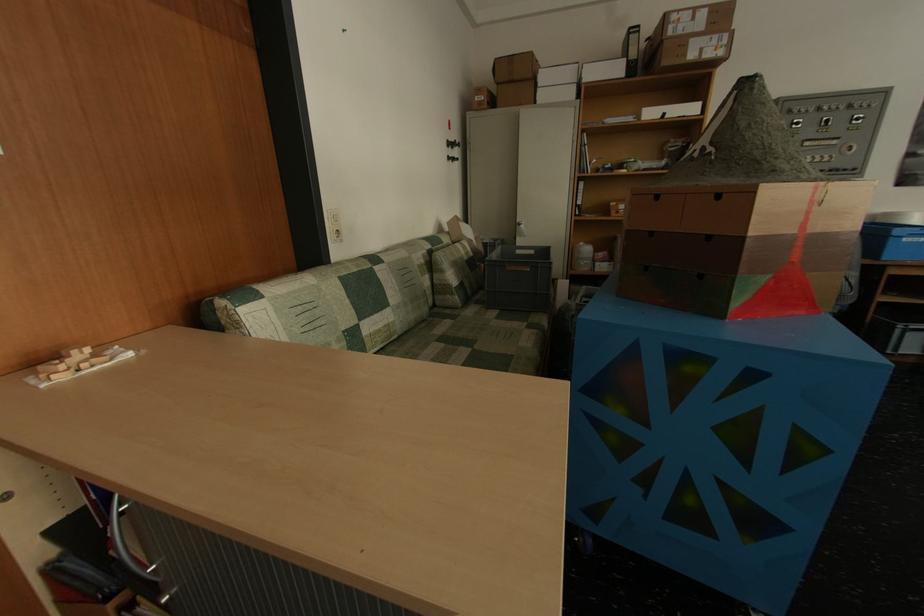
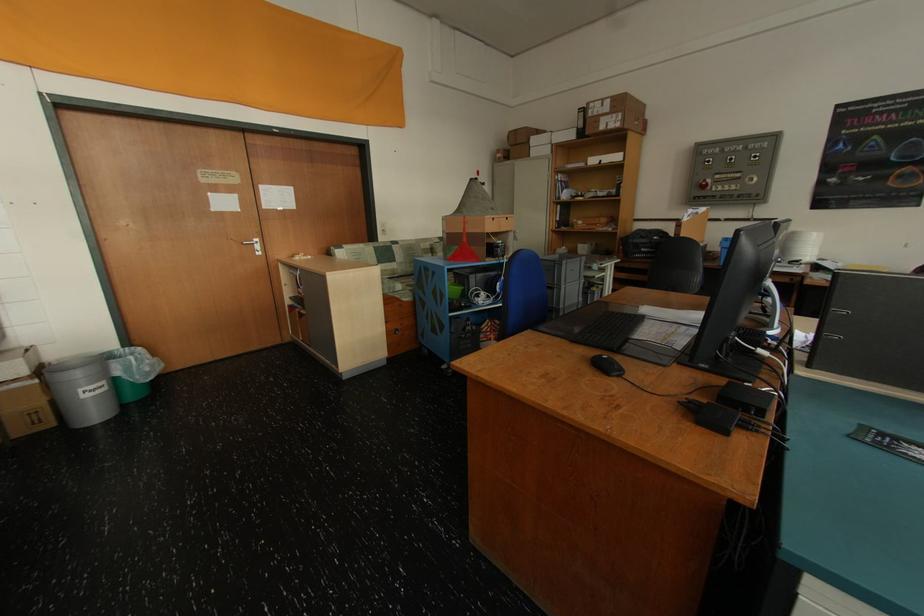
Find the pixel in the second image that matches [734,39] in the first image.

(628, 118)